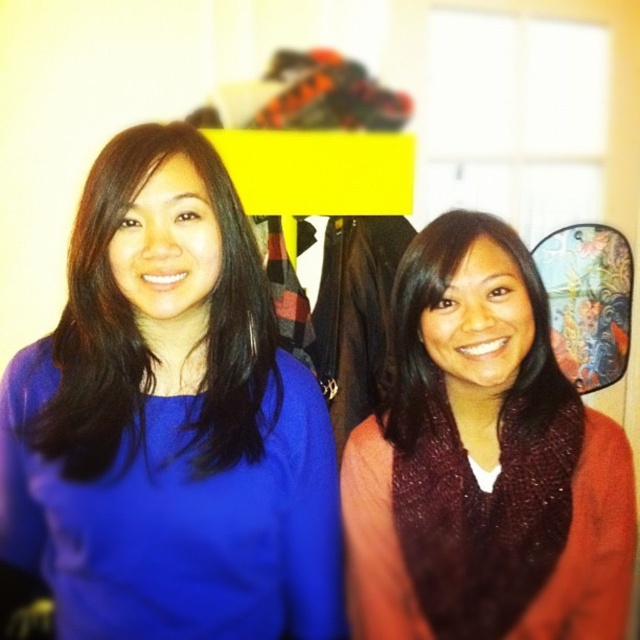
You are standing in the room shown in the image and want to reach the point marked at coordinates (420, 412). The room has a clearance of 5 feet from the floor to the ceiling. Can you safely walk to that point without hitting your head?

The point marked at coordinates (420, 412) is only 3.35 feet from the viewer, which is well within the 5 feet clearance. Therefore, you can safely walk to that point without hitting your head.

You are standing in a room where two people are posing for a photo. The person on the left is wearing a bright blue top, and the person on the right is wearing a red sweater over a maroon garment. There is a yellow rectangular object horizontally placed in the upper part of the image, and behind it, there is a rack with garments like a plaid shirt and others. A point at coordinates (170, 420) is marked. What object does this point correspond to?

The point at coordinates (170, 420) corresponds to the matte blue sweater at center.

You are trying to find the matte blue sweater at center in the image. According to the coordinates provided, where exactly is it positioned?

The matte blue sweater at center is located at point 0.659 along the x axis and 0.266 along the y axis.